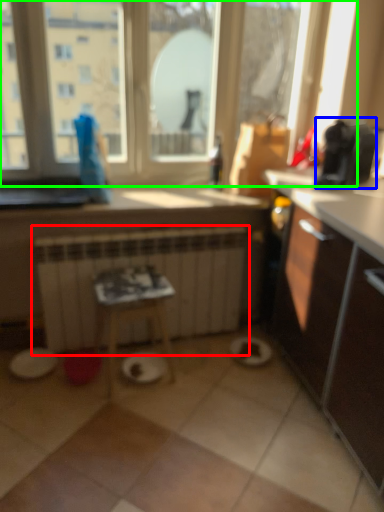
Question: Based on their relative distances, which object is nearer to radiator (highlighted by a red box)? Choose from appliance (highlighted by a blue box) and window (highlighted by a green box).

Choices:
 (A) appliance
 (B) window

Answer: (B)